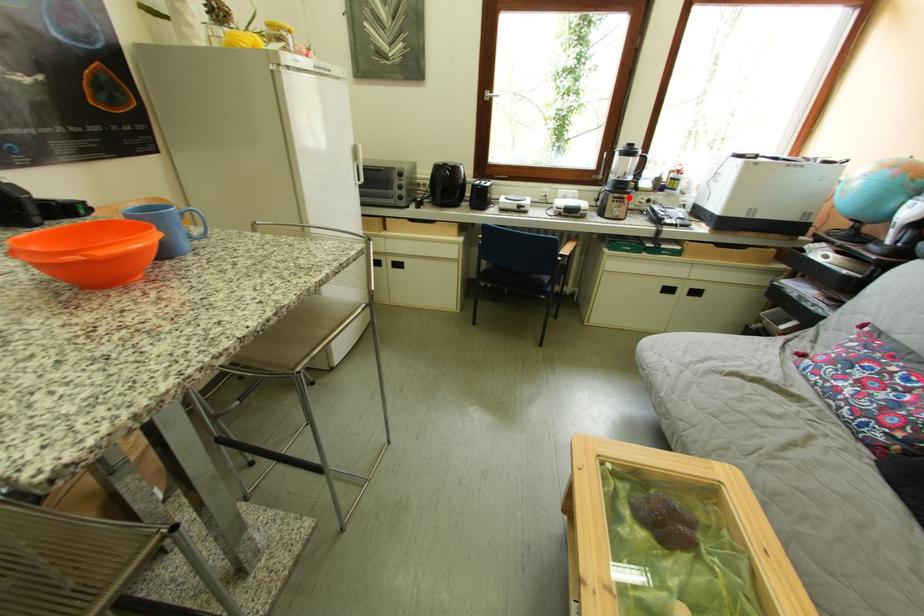
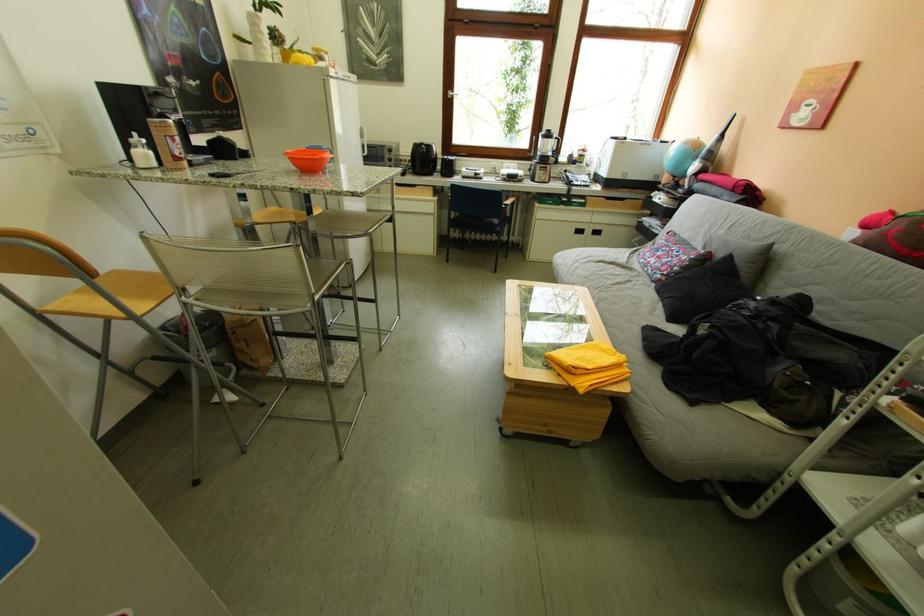
Locate, in the second image, the point that corresponds to the highlighted location in the first image.

(554, 169)